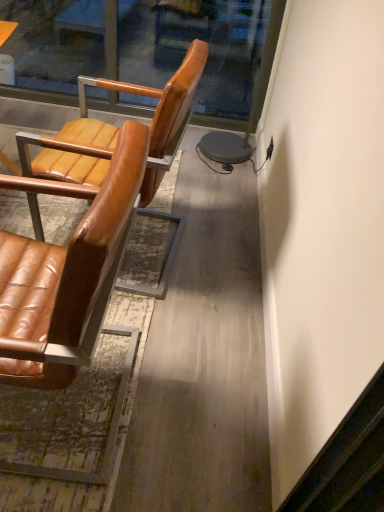
This screenshot has height=512, width=384. Identify the location of free space below brown leather chair at left, arranged as the 2th chair when viewed from the back (from a real-world perspective). (67, 408).